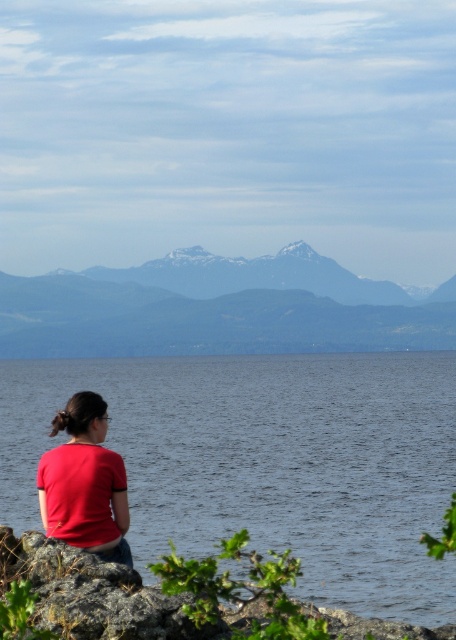
You are a photographer standing in the scene and want to take a photo of the snowy rocky mountain at center and the matte red shirt at lower left. Which object should you focus on first to ensure it appears sharp in the photo?

You should focus on the snowy rocky mountain at center first because it is closer to the viewer than the matte red shirt at lower left, so focusing on it will ensure both are in focus if they are within the depth of field.

From the picture: You are standing at the point with coordinates point [140,308] and want to walk towards the horizon. Is the point point [274,484] blocking your path?

Point point [274,484] is in front of point point [140,308], so it is blocking your path.